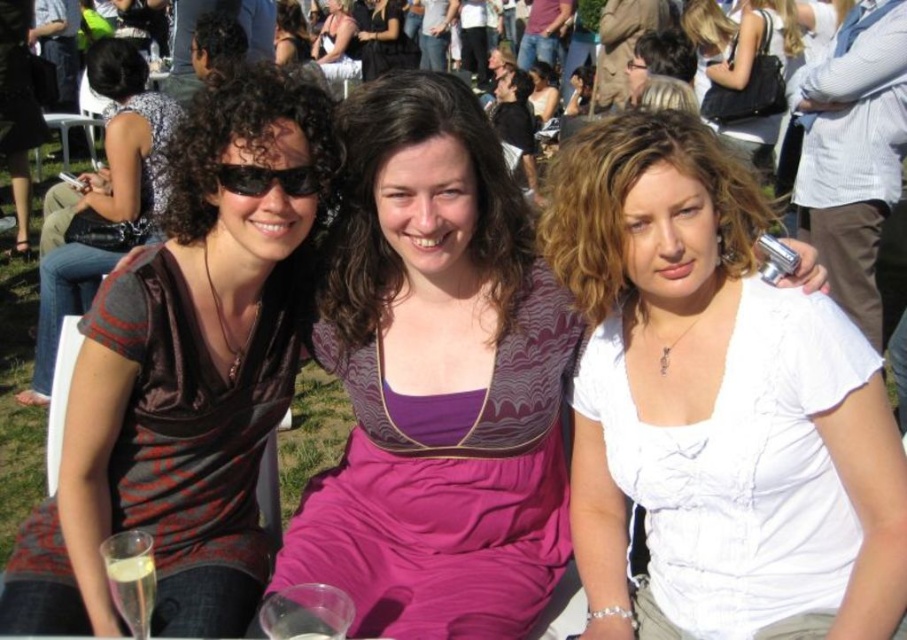
Question: Does matte black shirt at left come behind matte black hair at upper center?

Choices:
 (A) yes
 (B) no

Answer: (B)

Question: Observing the image, what is the correct spatial positioning of purple satin dress at center in reference to matte black dress at left?

Choices:
 (A) below
 (B) above

Answer: (A)

Question: Among these objects, which one is farthest from the camera?

Choices:
 (A) matte black dress at left
 (B) white matte shirt at center
 (C) black matte sunglasses at center

Answer: (A)

Question: Among these points, which one is nearest to the camera?

Choices:
 (A) (393, 22)
 (B) (532, 353)
 (C) (219, 244)
 (D) (402, 92)

Answer: (D)

Question: Can you confirm if matte black dress at left is smaller than matte black dress at upper center?

Choices:
 (A) yes
 (B) no

Answer: (B)

Question: Which of the following is the farthest from the observer?

Choices:
 (A) black matte sunglasses at center
 (B) matte black dress at upper center
 (C) black leather handbag at center

Answer: (B)